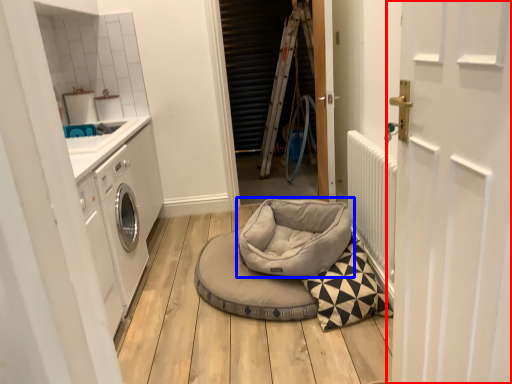
Question: Which object is further to the camera taking this photo, door (highlighted by a red box) or dog bed (highlighted by a blue box)?

Choices:
 (A) door
 (B) dog bed

Answer: (B)